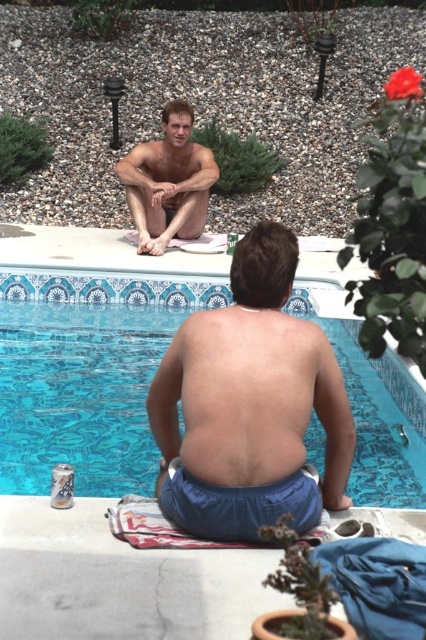
Question: Among these points, which one is nearest to the camera?

Choices:
 (A) (276, 365)
 (B) (345, 360)

Answer: (A)

Question: Among these points, which one is nearest to the camera?

Choices:
 (A) (207, 420)
 (B) (100, 314)
 (C) (172, 100)

Answer: (A)

Question: From the image, what is the correct spatial relationship of blue fabric shorts at center in relation to smooth skin man at upper center?

Choices:
 (A) below
 (B) above

Answer: (A)

Question: Does blue fabric shorts at center have a greater width compared to smooth skin man at upper center?

Choices:
 (A) yes
 (B) no

Answer: (B)

Question: Which is farther from the smooth skin man at upper center?

Choices:
 (A) blue glossy water at center
 (B) muscular tan skin at back

Answer: (B)

Question: Is blue glossy water at center to the left of smooth skin man at upper center from the viewer's perspective?

Choices:
 (A) no
 (B) yes

Answer: (B)